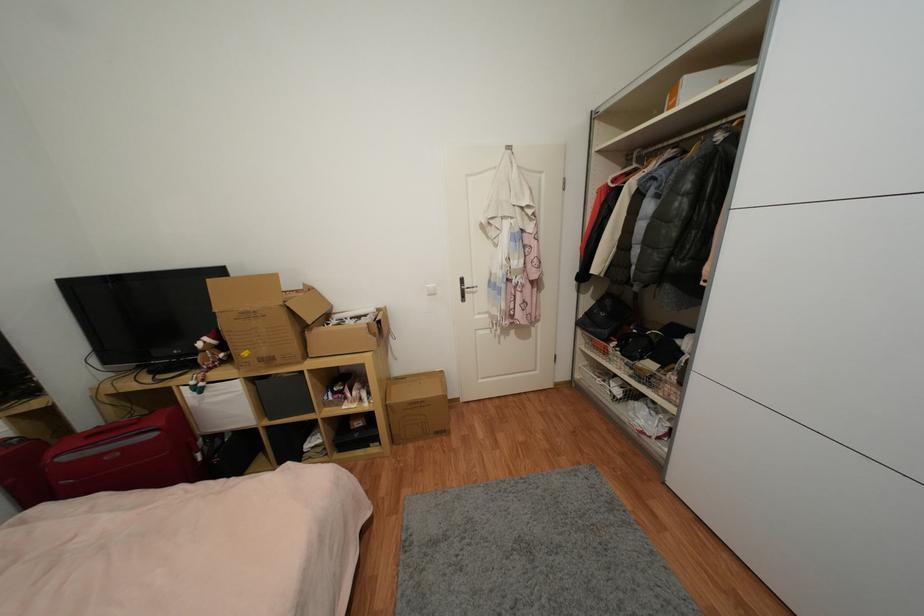
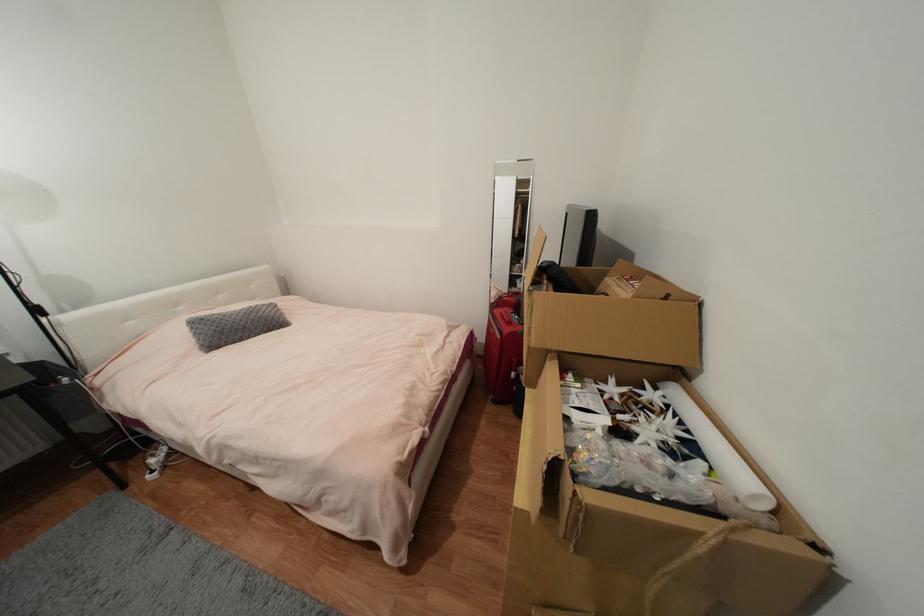
The point at [204,456] is marked in the first image. Where is the corresponding point in the second image?

(517, 375)